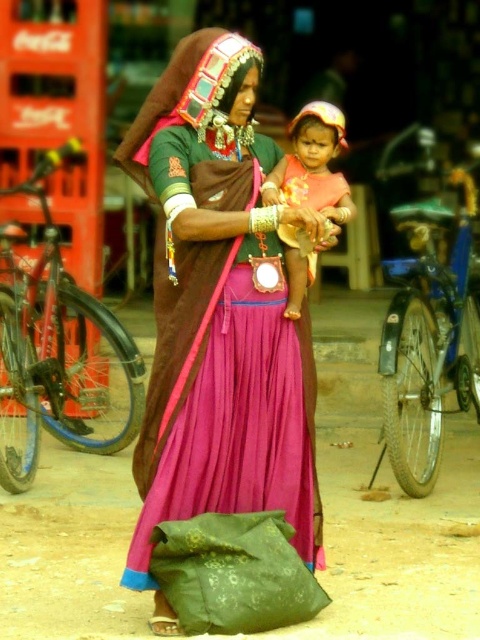
You are an assistant helping someone choose between two pink outfits for a formal event. The outfits are the pink satin saree at center and the matte pink fabric at center. According to the image, which one is placed to the left?

The pink satin saree at center is positioned on the left side of matte pink fabric at center, so it is the one placed to the left.

You are a photographer setting up for a cultural event. You need to decide which pink fabric to use for the backdrop. The options are the pink satin saree at center and the matte pink fabric at center. Based on their sizes, which one would you choose if you want a larger backdrop?

The pink satin saree at center has a larger size compared to the matte pink fabric at center, so you should choose the pink satin saree at center for a larger backdrop.